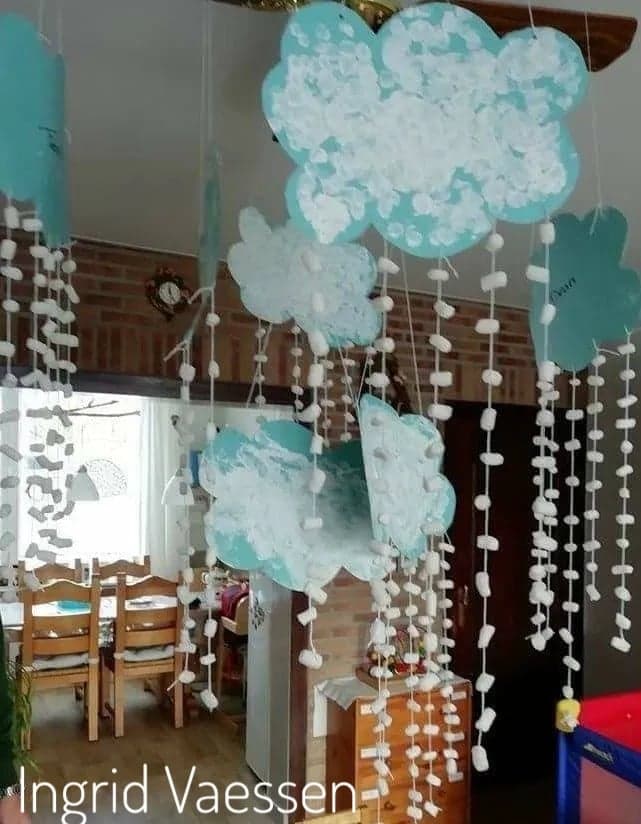
In order to click on clock in this screenshot , I will do `click(163, 298)`.